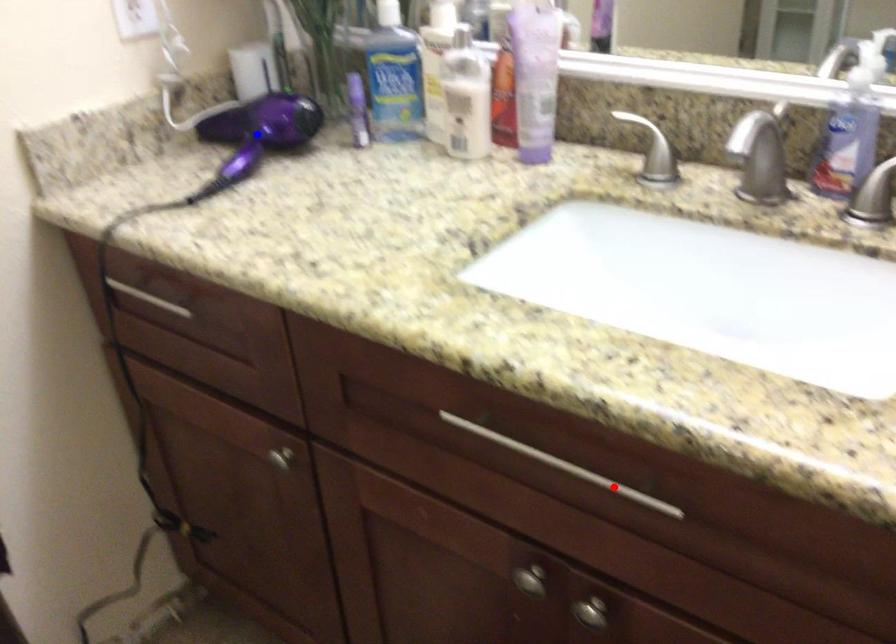
Question: Which of the two points in the image is closer to the camera?

Choices:
 (A) Blue point is closer.
 (B) Red point is closer.

Answer: (B)